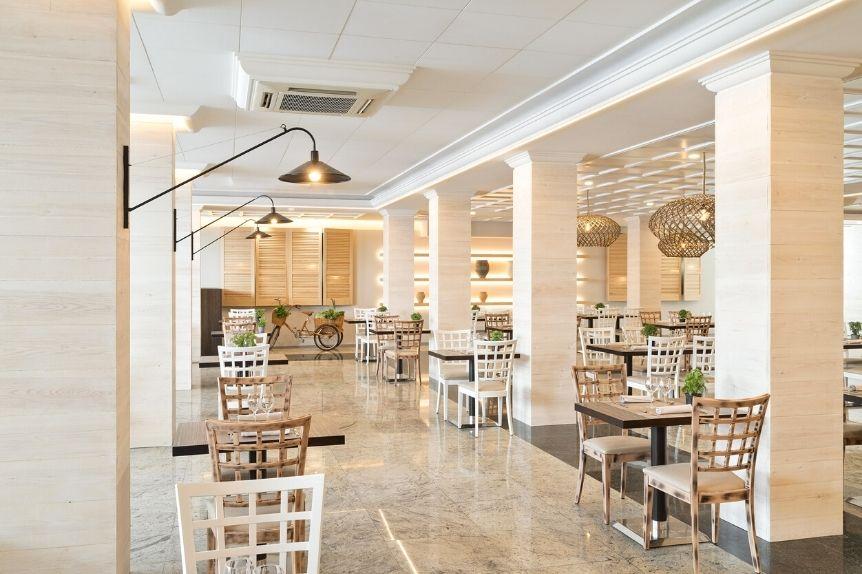
I want to click on light fixtures, so click(335, 166), click(272, 212), click(261, 231), click(598, 231), click(702, 230), click(694, 250).